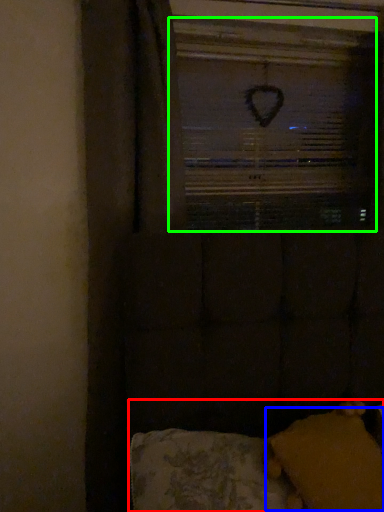
Question: Which object is positioned closest to furniture (highlighted by a red box)? Select from pillow (highlighted by a blue box) and window screen (highlighted by a green box).

Choices:
 (A) pillow
 (B) window screen

Answer: (A)